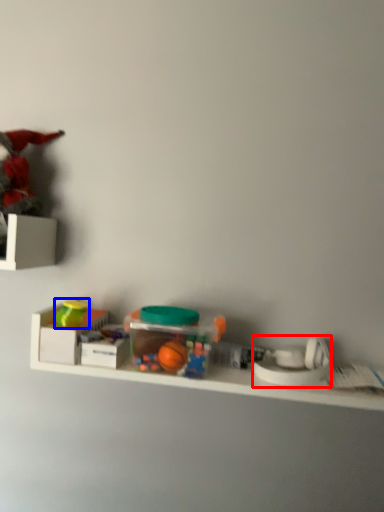
Question: Which of the following is the farthest to the observer, toy (highlighted by a red box) or toy (highlighted by a blue box)?

Choices:
 (A) toy
 (B) toy

Answer: (B)